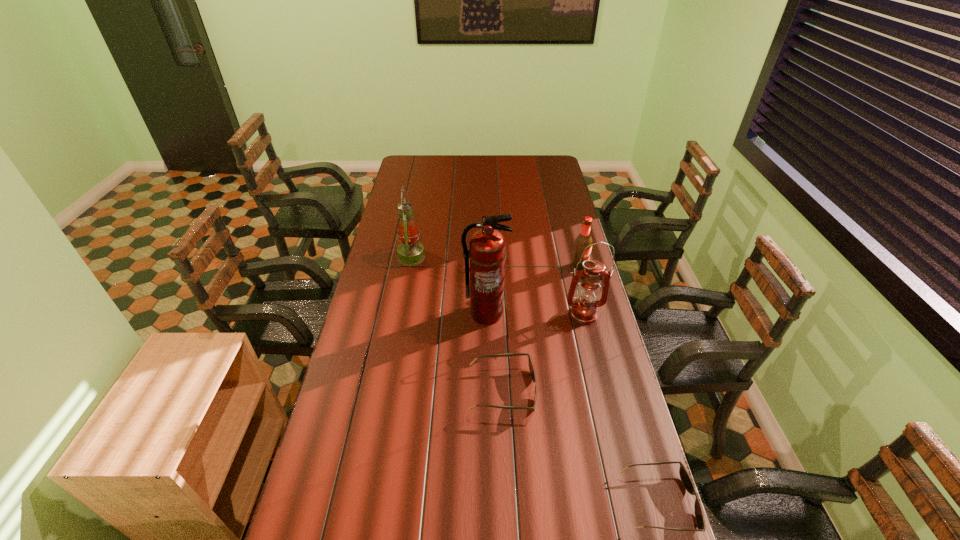
All sunglassess are currently evenly spaced. To continue this pattern, where would you add another sunglasses on the left? Please point out a vacant spot. Please provide its 2D coordinates. Your answer should be formatted as a tuple, i.e. [(x, y)], where the tuple contains the x and y coordinates of a point satisfying the conditions above.

[(395, 313)]